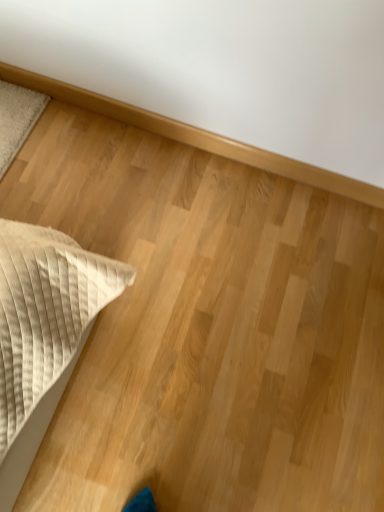
Image resolution: width=384 pixels, height=512 pixels. In order to click on blank area beneath natural wood baseboard at upper center (from a real-world perspective) in this screenshot , I will do `click(193, 144)`.